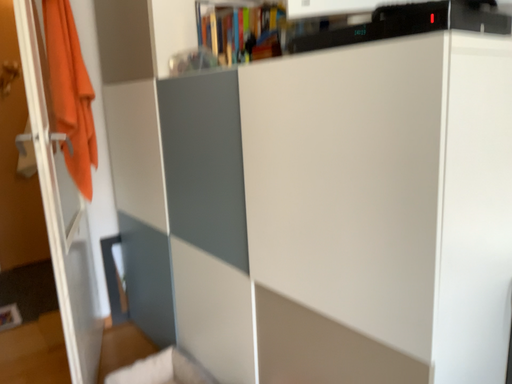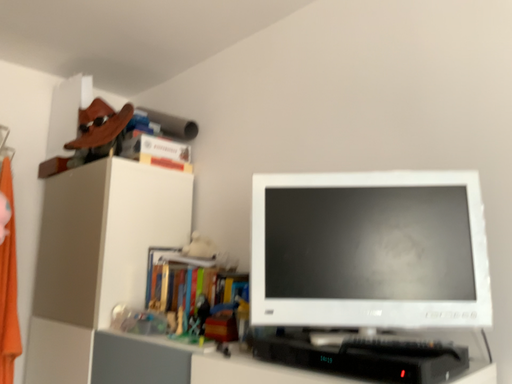
Question: Which way did the camera rotate in the video?

Choices:
 (A) rotated downward
 (B) rotated upward

Answer: (B)